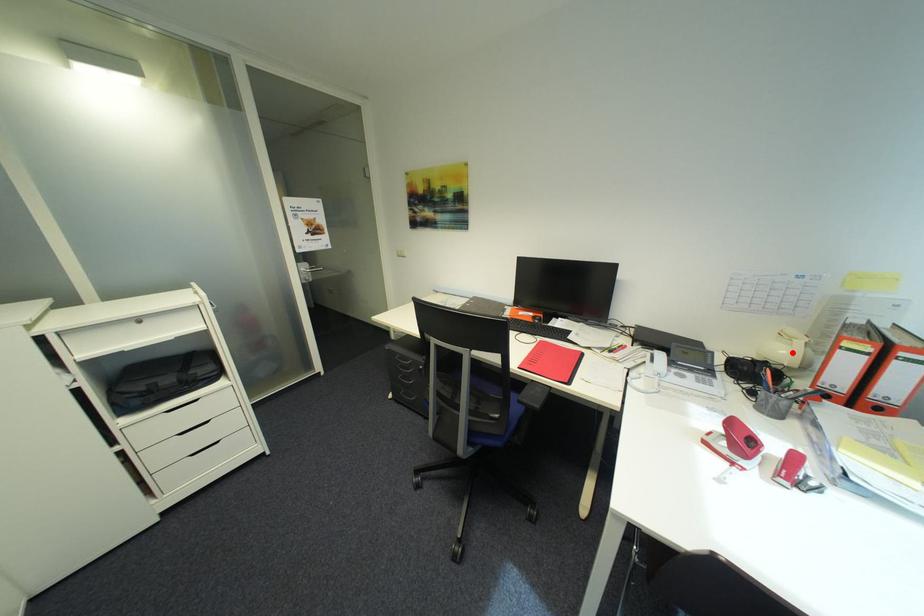
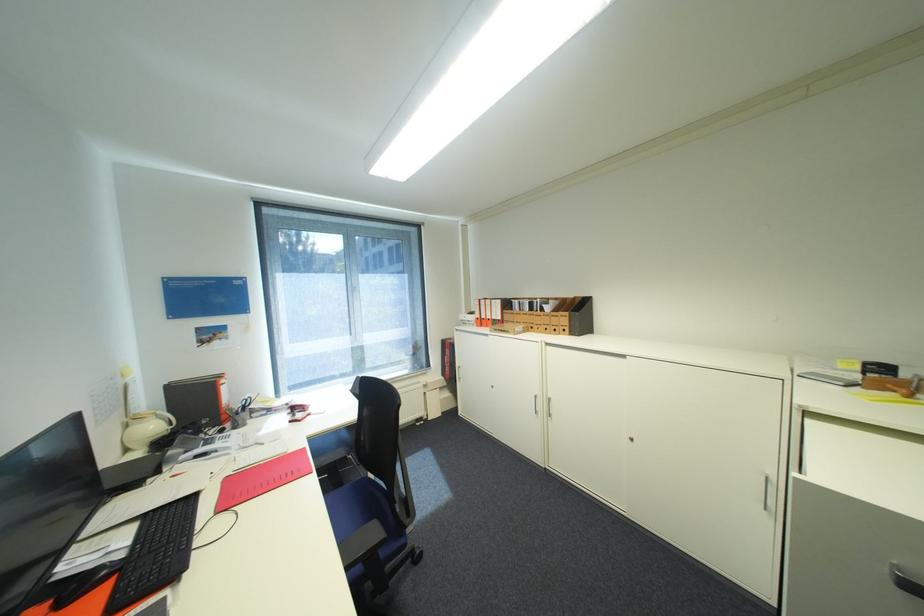
Question: I am providing you with two images of the same scene from different viewpoints. A red point is marked on the first image. Is the red point's position out of view in image 2?

Choices:
 (A) Yes
 (B) No

Answer: (B)